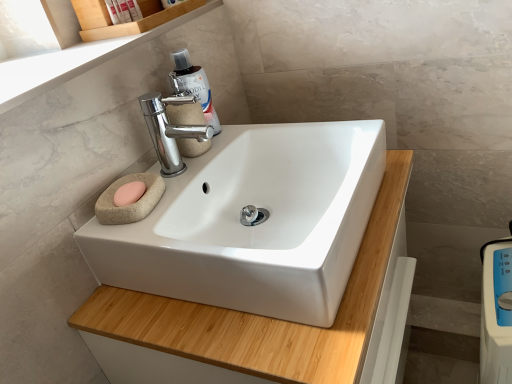
You are a GUI agent. You are given a task and a screenshot of the screen. Output one action in this format:
    pyautogui.click(x=<x>, y=<y>)
    Task: Click on the free spot in front of matte plastic soap at upper left, the second toiletry when ordered from right to left
    The image size is (512, 384).
    Given the screenshot: What is the action you would take?
    pyautogui.click(x=114, y=37)